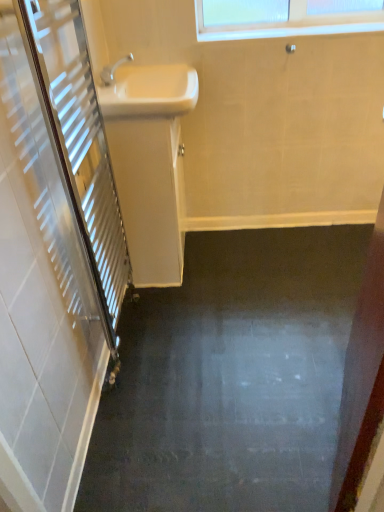
Question: Considering the relative positions of white glossy sink at upper center, which is the 1th sink in top-to-bottom order, and white glossy sink at upper center, which is the second sink from top to bottom, in the image provided, is white glossy sink at upper center, which is the 1th sink in top-to-bottom order, to the left of white glossy sink at upper center, which is the second sink from top to bottom, from the viewer's perspective?

Choices:
 (A) yes
 (B) no

Answer: (B)

Question: From the image's perspective, is white glossy sink at upper center, which ranks as the second sink in bottom-to-top order, under white glossy sink at upper center, which is the second sink from top to bottom?

Choices:
 (A) yes
 (B) no

Answer: (B)

Question: Is white glossy sink at upper center, which is the second sink from top to bottom, located within white glossy sink at upper center, which is the 1th sink in top-to-bottom order?

Choices:
 (A) yes
 (B) no

Answer: (B)

Question: Is there a large distance between white glossy sink at upper center, which is the 1th sink in top-to-bottom order, and white glossy sink at upper center, the first sink when ordered from bottom to top?

Choices:
 (A) yes
 (B) no

Answer: (B)

Question: Is white glossy sink at upper center, which ranks as the second sink in bottom-to-top order, turned away from white glossy sink at upper center, which is the second sink from top to bottom?

Choices:
 (A) yes
 (B) no

Answer: (B)

Question: Does white glossy sink at upper center, which ranks as the second sink in bottom-to-top order, have a greater width compared to white glossy sink at upper center, the first sink when ordered from bottom to top?

Choices:
 (A) yes
 (B) no

Answer: (A)

Question: Are white glossy sink at upper center, which is the second sink from top to bottom, and white glossy sink at upper center, which ranks as the second sink in bottom-to-top order, making contact?

Choices:
 (A) yes
 (B) no

Answer: (B)

Question: Does white glossy sink at upper center, the first sink when ordered from bottom to top, have a lesser height compared to white glossy sink at upper center, which is the 1th sink in top-to-bottom order?

Choices:
 (A) yes
 (B) no

Answer: (B)

Question: Does white glossy sink at upper center, the first sink when ordered from bottom to top, turn towards white glossy sink at upper center, which is the 1th sink in top-to-bottom order?

Choices:
 (A) no
 (B) yes

Answer: (A)

Question: Can you confirm if white glossy sink at upper center, which is the second sink from top to bottom, is taller than white glossy sink at upper center, which is the 1th sink in top-to-bottom order?

Choices:
 (A) yes
 (B) no

Answer: (A)

Question: From the image's perspective, is white glossy sink at upper center, which is the second sink from top to bottom, on top of white glossy sink at upper center, which ranks as the second sink in bottom-to-top order?

Choices:
 (A) no
 (B) yes

Answer: (A)

Question: Is white glossy sink at upper center, which is the second sink from top to bottom, wider than white glossy sink at upper center, which is the 1th sink in top-to-bottom order?

Choices:
 (A) yes
 (B) no

Answer: (B)

Question: Based on their sizes in the image, would you say white glossy sink at upper center, which ranks as the second sink in bottom-to-top order, is bigger or smaller than white glossy sink at upper center, which is the second sink from top to bottom?

Choices:
 (A) big
 (B) small

Answer: (B)